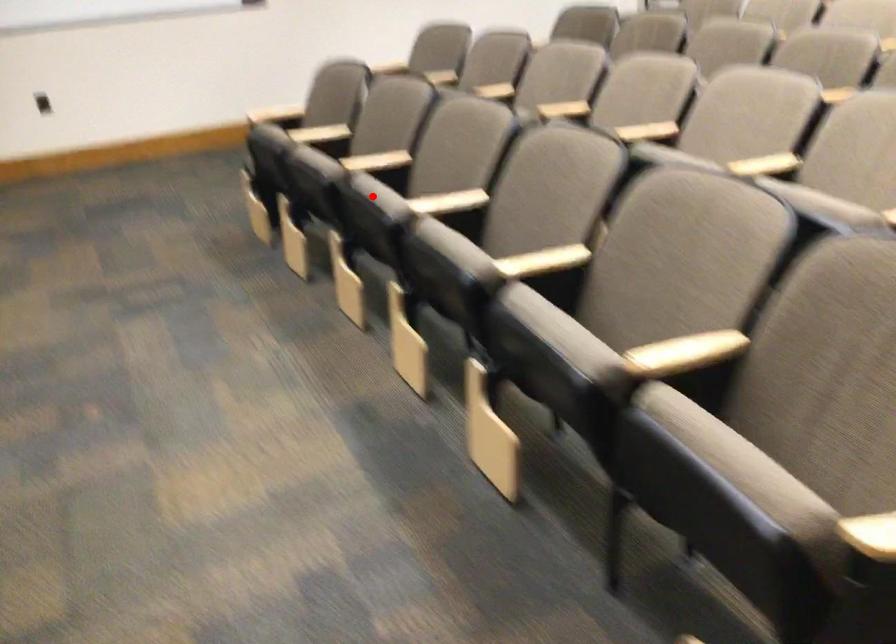
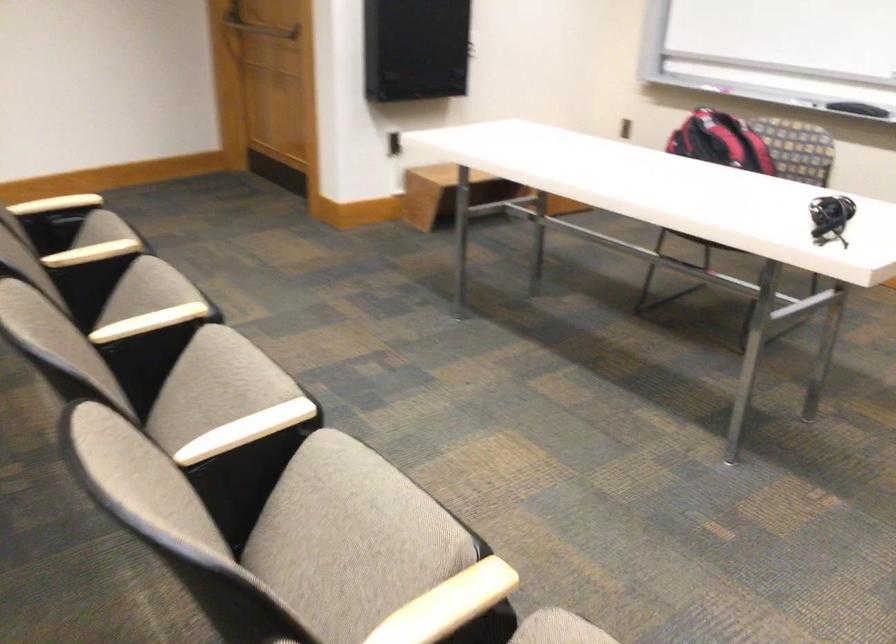
Where in the second image is the point corresponding to the highlighted location from the first image?

(352, 531)